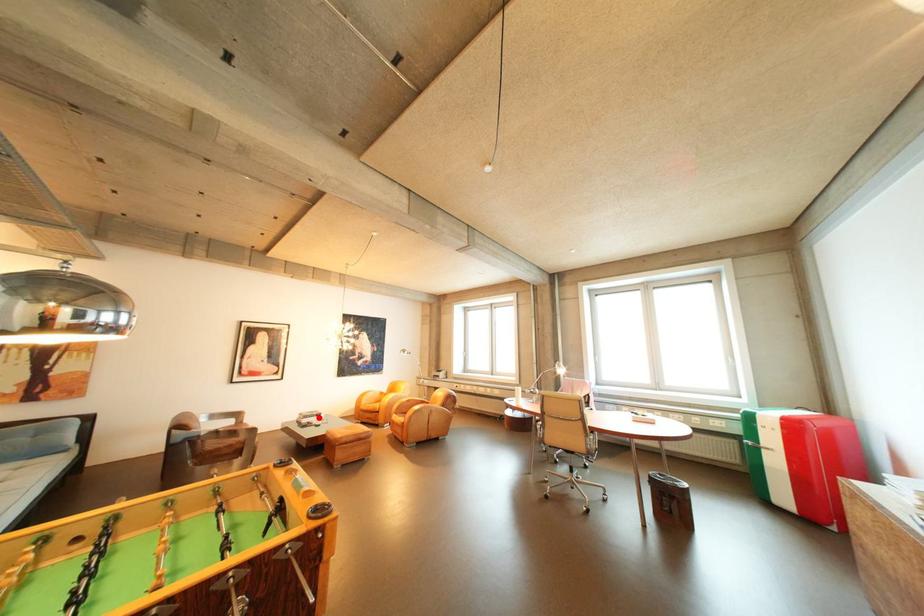
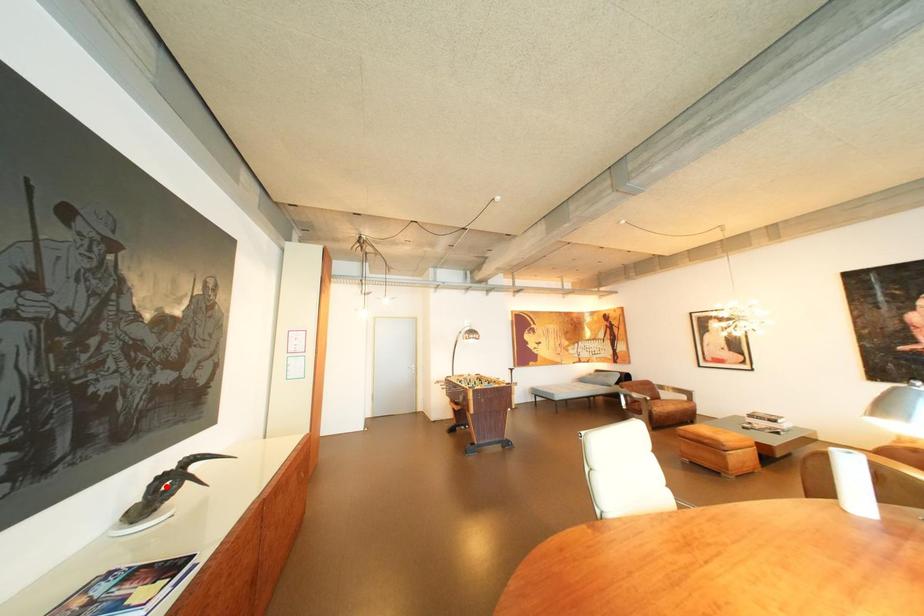
I am providing you with two images of the same scene from different viewpoints. A red point is marked on the first image and another point is marked on the second image. Do the highlighted points in image1 and image2 indicate the same real-world spot?

No